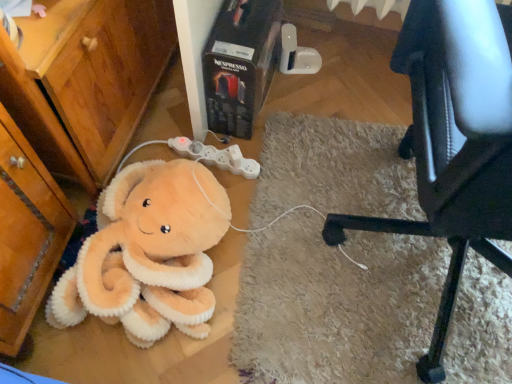
Question: Is soft plush octopus at lower left inside the boundaries of white plastic game controller at center, or outside?

Choices:
 (A) outside
 (B) inside

Answer: (A)

Question: From the image's perspective, is soft plush octopus at lower left positioned above or below white plastic game controller at center?

Choices:
 (A) below
 (B) above

Answer: (A)

Question: Which is farther from the black leather chair at lower right?

Choices:
 (A) white plastic game controller at center
 (B) soft plush octopus at lower left
 (C) wooden dresser at lower left

Answer: (C)

Question: Estimate the real-world distances between objects in this image. Which object is closer to the soft plush octopus at lower left?

Choices:
 (A) wooden dresser at lower left
 (B) black leather chair at lower right
 (C) white plastic game controller at center

Answer: (A)